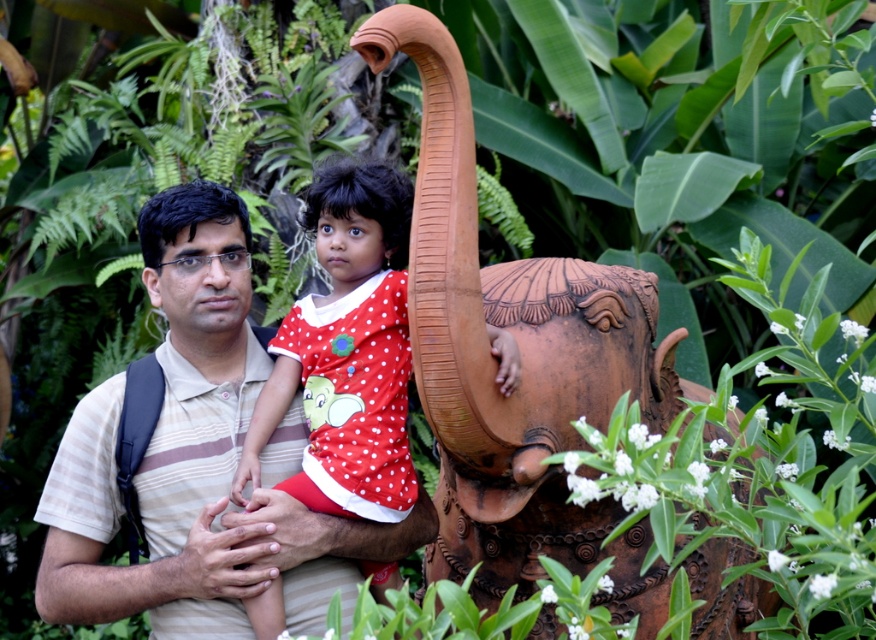
Question: Can you confirm if terracotta elephant at center is wider than polka dot fabric dress at center?

Choices:
 (A) no
 (B) yes

Answer: (B)

Question: Where is terracotta elephant at center located in relation to polka dot fabric dress at center in the image?

Choices:
 (A) below
 (B) above

Answer: (A)

Question: Is terracotta elephant at center bigger than polka dot fabric dress at center?

Choices:
 (A) yes
 (B) no

Answer: (A)

Question: Which object is positioned closest to the polka dot fabric dress at center?

Choices:
 (A) terracotta elephant at center
 (B) striped cotton shirt at center

Answer: (B)

Question: Which object is closer to the camera taking this photo?

Choices:
 (A) polka dot fabric dress at center
 (B) striped cotton shirt at center
 (C) terracotta elephant at center

Answer: (C)

Question: Which of the following is the farthest from the observer?

Choices:
 (A) (331, 346)
 (B) (458, 497)

Answer: (A)